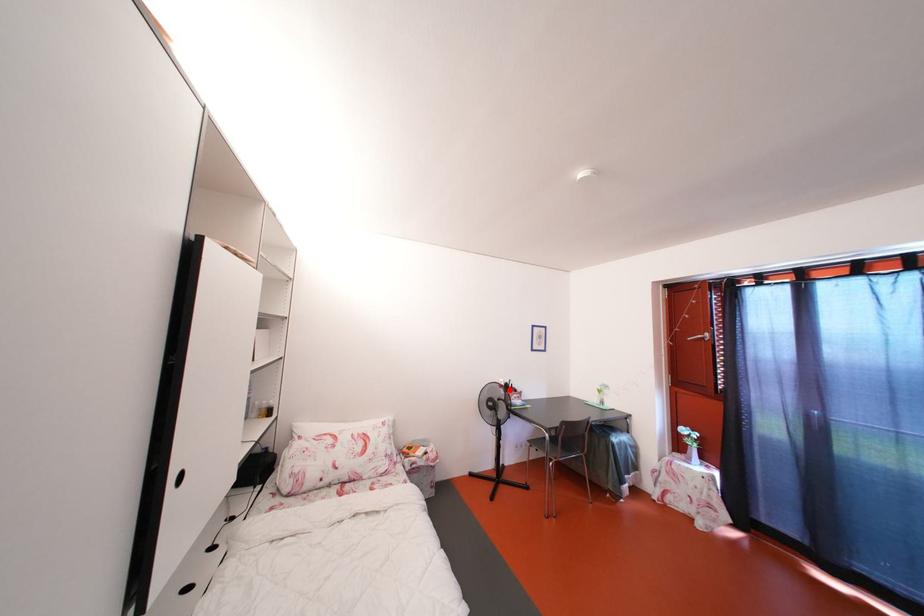
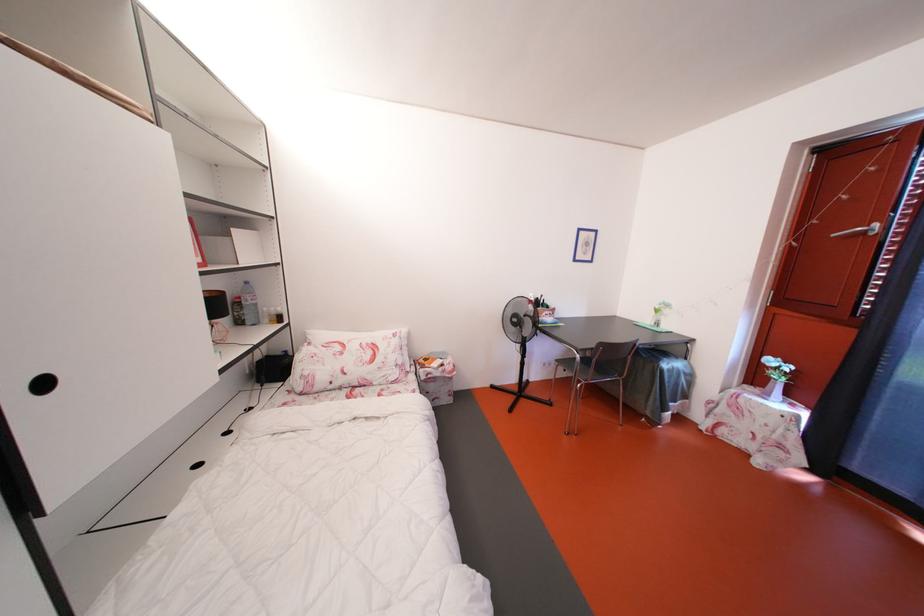
Where in the second image is the point corresponding to the highlighted location from the first image?

(540, 305)